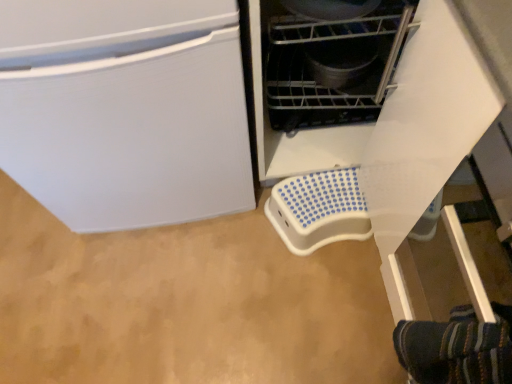
Question: Is metallic gray pot at center, marked as the 1th appliance in a top-to-bottom arrangement, to the left or to the right of white plastic step stool at lower center, the 1th appliance when ordered from back to front, in the image?

Choices:
 (A) right
 (B) left

Answer: (B)

Question: Is metallic gray pot at center, placed as the second appliance when sorted from back to front, taller or shorter than white plastic step stool at lower center, the 1th appliance when ordered from back to front?

Choices:
 (A) short
 (B) tall

Answer: (B)

Question: In terms of size, does metallic gray pot at center, the second appliance ordered from the bottom, appear bigger or smaller than white plastic step stool at lower center, placed as the first appliance when sorted from bottom to top?

Choices:
 (A) small
 (B) big

Answer: (B)

Question: In terms of height, does white plastic step stool at lower center, placed as the first appliance when sorted from bottom to top, look taller or shorter compared to metallic gray pot at center, the second appliance ordered from the bottom?

Choices:
 (A) tall
 (B) short

Answer: (B)

Question: Is white plastic step stool at lower center, the 1th appliance when ordered from back to front, inside the boundaries of metallic gray pot at center, the 1th appliance when ordered from front to back, or outside?

Choices:
 (A) outside
 (B) inside

Answer: (A)

Question: From the image's perspective, relative to metallic gray pot at center, placed as the second appliance when sorted from back to front, is white plastic step stool at lower center, the 1th appliance when ordered from back to front, above or below?

Choices:
 (A) above
 (B) below

Answer: (B)

Question: In terms of width, does white plastic step stool at lower center, the second appliance from the front, look wider or thinner when compared to metallic gray pot at center, the 1th appliance when ordered from front to back?

Choices:
 (A) thin
 (B) wide

Answer: (B)